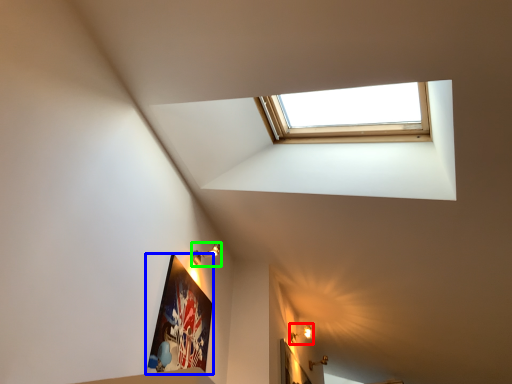
Question: Which object is positioned closest to light fixture (highlighted by a red box)? Select from picture frame (highlighted by a blue box) and light fixture (highlighted by a green box).

Choices:
 (A) picture frame
 (B) light fixture

Answer: (B)